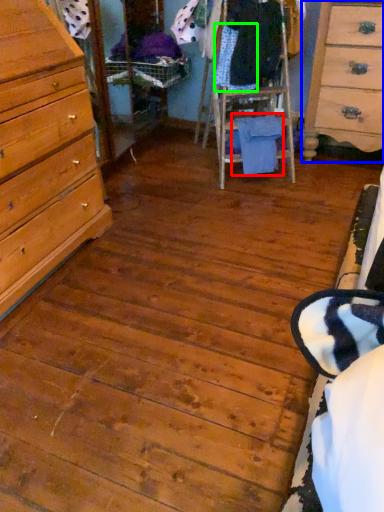
Question: Estimate the real-world distances between objects in this image. Which object is closer to clothing (highlighted by a red box), chest of drawers (highlighted by a blue box) or clothing (highlighted by a green box)?

Choices:
 (A) chest of drawers
 (B) clothing

Answer: (B)